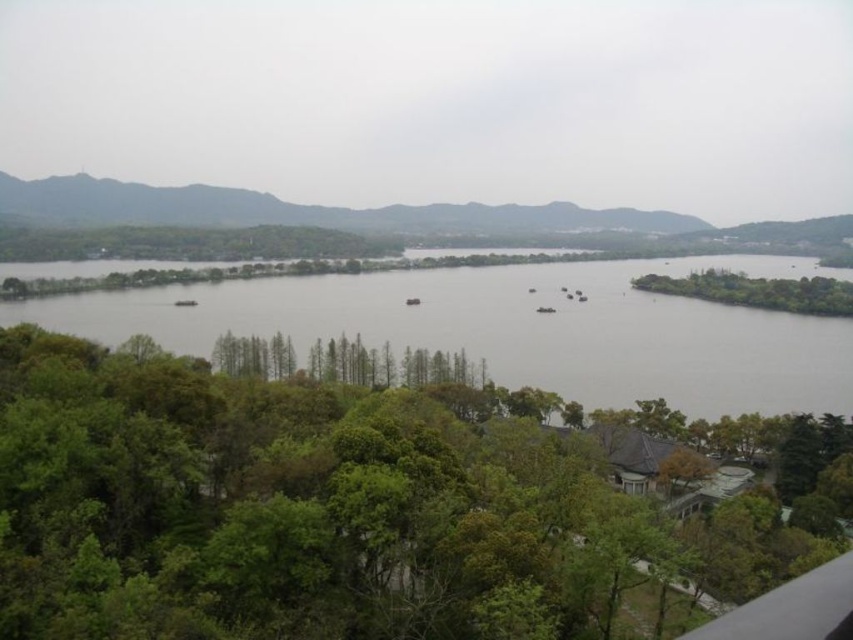
Does green leafy tree at center have a greater width compared to green leafy tree at right?

Incorrect, green leafy tree at center's width does not surpass green leafy tree at right's.

Find the location of a particular element. Image resolution: width=853 pixels, height=640 pixels. green leafy tree at center is located at coordinates (303, 509).

This screenshot has width=853, height=640. Identify the location of green leafy tree at center. (303, 509).

Who is positioned more to the left, green leafy tree at center or gray water at center?

green leafy tree at center

Is green leafy tree at center positioned in front of gray water at center?

Yes, it is.

Who is more distant from viewer, (457, 573) or (831, 337)?

The point (831, 337) is more distant.

Where is `green leafy tree at center`? Image resolution: width=853 pixels, height=640 pixels. green leafy tree at center is located at coordinates (303, 509).

Does green leafy tree at center have a lesser width compared to green matte mountains at upper left?

Indeed, green leafy tree at center has a lesser width compared to green matte mountains at upper left.

Between point (281, 436) and point (666, 243), which one is positioned in front?

Point (281, 436) is more forward.

Find the location of a particular element. The height and width of the screenshot is (640, 853). green leafy tree at center is located at coordinates (303, 509).